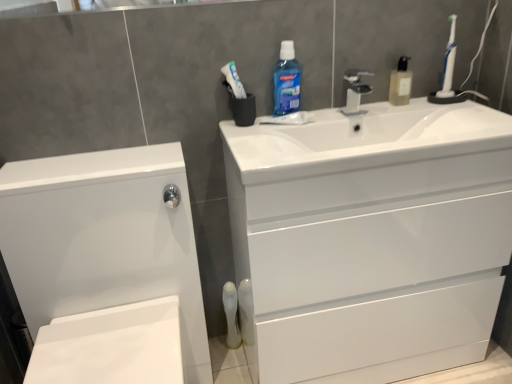
What do you see at coordinates (449, 63) in the screenshot? The width and height of the screenshot is (512, 384). I see `white plastic toothbrush at upper right` at bounding box center [449, 63].

Where is `blue translucent liquid at upper center, the first cleaning product viewed from the left`? This screenshot has height=384, width=512. blue translucent liquid at upper center, the first cleaning product viewed from the left is located at coordinates (286, 81).

This screenshot has height=384, width=512. Describe the element at coordinates (354, 91) in the screenshot. I see `satin nickel faucet at center` at that location.

Locate an element on the screen. translucent plastic soap dispenser at upper right, the 1th cleaning product from the right is located at coordinates tap(400, 83).

Is translucent plastic soap dispenser at upper right, the 1th cleaning product from the right, positioned with its back to satin nickel faucet at center?

That's not correct — translucent plastic soap dispenser at upper right, the 1th cleaning product from the right, is not looking away from satin nickel faucet at center.

Consider the image. Can you confirm if translucent plastic soap dispenser at upper right, the 1th cleaning product from the right, is smaller than satin nickel faucet at center?

Actually, translucent plastic soap dispenser at upper right, the 1th cleaning product from the right, might be larger than satin nickel faucet at center.

Which is less distant, (404, 76) or (354, 104)?

Positioned in front is point (404, 76).

In the image, is translucent plastic soap dispenser at upper right, the second cleaning product from the left, positioned in front of or behind satin nickel faucet at center?

In the image, translucent plastic soap dispenser at upper right, the second cleaning product from the left, appears behind satin nickel faucet at center.

Which of these two, translucent plastic soap dispenser at upper right, the second cleaning product from the left, or white plastic toothbrush at upper right, is wider?

translucent plastic soap dispenser at upper right, the second cleaning product from the left, is wider.

From a real-world perspective, which object stands above the other?

white plastic toothbrush at upper right, from a real-world perspective.

Are translucent plastic soap dispenser at upper right, the 1th cleaning product from the right, and white plastic toothbrush at upper right located far from each other?

No, there isn't a large distance between translucent plastic soap dispenser at upper right, the 1th cleaning product from the right, and white plastic toothbrush at upper right.

From the picture: Is translucent plastic soap dispenser at upper right, the second cleaning product from the left, turned away from white plastic toothbrush at upper right?

No, white plastic toothbrush at upper right is not at the back of translucent plastic soap dispenser at upper right, the second cleaning product from the left.

Which is in front, point (152, 309) or point (461, 156)?

Positioned in front is point (461, 156).

Would you say white glossy cabinet at lower left contains white glossy drawer at center?

No, white glossy drawer at center is located outside of white glossy cabinet at lower left.

Between white glossy cabinet at lower left and white glossy drawer at center, which one has smaller width?

white glossy drawer at center is thinner.

Is white glossy cabinet at lower left further to camera compared to white glossy drawer at center?

No, it is not.

From a real-world perspective, is white glossy cabinet at lower left below blue translucent liquid at upper center, acting as the second cleaning product starting from the right?

Yes, from a real-world perspective, white glossy cabinet at lower left is under blue translucent liquid at upper center, acting as the second cleaning product starting from the right.

Does white glossy cabinet at lower left appear on the right side of blue translucent liquid at upper center, the first cleaning product viewed from the left?

Incorrect, white glossy cabinet at lower left is not on the right side of blue translucent liquid at upper center, the first cleaning product viewed from the left.

Would you say white glossy cabinet at lower left is inside or outside blue translucent liquid at upper center, the first cleaning product viewed from the left?

white glossy cabinet at lower left exists outside the volume of blue translucent liquid at upper center, the first cleaning product viewed from the left.

Does white plastic toothbrush at upper right turn towards white glossy cabinet at lower left?

No, white plastic toothbrush at upper right is not facing towards white glossy cabinet at lower left.

Is the surface of white plastic toothbrush at upper right in direct contact with white glossy cabinet at lower left?

No, white plastic toothbrush at upper right is not beside white glossy cabinet at lower left.

From the image's perspective, between white plastic toothbrush at upper right and white glossy cabinet at lower left, who is located below?

white glossy cabinet at lower left, from the image's perspective.

Is white plastic toothbrush at upper right further to camera compared to translucent plastic mouthwash at lower center?

No, white plastic toothbrush at upper right is closer to the viewer.

From the image's perspective, would you say white plastic toothbrush at upper right is shown under translucent plastic mouthwash at lower center?

Incorrect, from the image's perspective, white plastic toothbrush at upper right is higher than translucent plastic mouthwash at lower center.

Considering the positions of point (451, 21) and point (234, 326), is point (451, 21) closer or farther from the camera than point (234, 326)?

Point (451, 21) is positioned closer to the camera compared to point (234, 326).

Locate an element on the screen. counter top in front of the blue translucent liquid at upper center, the first cleaning product viewed from the left is located at coordinates (371, 238).

Is blue translucent liquid at upper center, the first cleaning product viewed from the left, located within white glossy sink at upper center?

That's incorrect, blue translucent liquid at upper center, the first cleaning product viewed from the left, is not inside white glossy sink at upper center.

Is white glossy sink at upper center wider than blue translucent liquid at upper center, acting as the second cleaning product starting from the right?

Correct, the width of white glossy sink at upper center exceeds that of blue translucent liquid at upper center, acting as the second cleaning product starting from the right.

The width and height of the screenshot is (512, 384). Find the location of `tap lying in front of the translucent plastic soap dispenser at upper right, the 1th cleaning product from the right`. tap lying in front of the translucent plastic soap dispenser at upper right, the 1th cleaning product from the right is located at coordinates (354, 91).

You are a GUI agent. You are given a task and a screenshot of the screen. Output one action in this format:
    pyautogui.click(x=<x>, y=<y>)
    Task: Click on the toothbrush on the right of translucent plastic soap dispenser at upper right, the second cleaning product from the left
    
    Given the screenshot: What is the action you would take?
    pyautogui.click(x=449, y=63)

When comparing their distances from satin nickel faucet at center, does translucent plastic soap dispenser at upper right, the second cleaning product from the left, or translucent plastic mouthwash at lower center seem closer?

translucent plastic soap dispenser at upper right, the second cleaning product from the left, is closer to satin nickel faucet at center.

Estimate the real-world distances between objects in this image. Which object is further from white glossy sink at upper center, white glossy drawer at center or translucent plastic soap dispenser at upper right, the 1th cleaning product from the right?

translucent plastic soap dispenser at upper right, the 1th cleaning product from the right, is further to white glossy sink at upper center.

Estimate the real-world distances between objects in this image. Which object is further from white glossy sink at upper center, white glossy drawer at center or white glossy cabinet at lower left?

white glossy cabinet at lower left is further to white glossy sink at upper center.

Considering their positions, is white glossy drawer at center positioned further to satin nickel faucet at center than blue translucent liquid at upper center, the first cleaning product viewed from the left?

white glossy drawer at center lies further to satin nickel faucet at center than the other object.

Estimate the real-world distances between objects in this image. Which object is further from translucent plastic soap dispenser at upper right, the second cleaning product from the left, white plastic toothbrush at upper right or translucent plastic mouthwash at lower center?

translucent plastic mouthwash at lower center is further to translucent plastic soap dispenser at upper right, the second cleaning product from the left.

When comparing their distances from white plastic toothbrush at upper right, does white glossy drawer at center or blue translucent liquid at upper center, acting as the second cleaning product starting from the right, seem further?

blue translucent liquid at upper center, acting as the second cleaning product starting from the right.

From the image, which object appears to be farther from blue translucent liquid at upper center, the first cleaning product viewed from the left, satin nickel faucet at center or translucent plastic mouthwash at lower center?

translucent plastic mouthwash at lower center.

Estimate the real-world distances between objects in this image. Which object is closer to satin nickel faucet at center, white glossy drawer at center or white plastic toothbrush at upper right?

The object closer to satin nickel faucet at center is white plastic toothbrush at upper right.

Locate an element on the screen. tap between white glossy cabinet at lower left and white glossy sink at upper center is located at coordinates (354, 91).

The height and width of the screenshot is (384, 512). In order to click on tap between translucent plastic soap dispenser at upper right, the 1th cleaning product from the right, and white glossy sink at upper center, in the vertical direction in this screenshot , I will do `click(354, 91)`.

Find the location of a particular element. The image size is (512, 384). tap between blue translucent liquid at upper center, acting as the second cleaning product starting from the right, and white glossy cabinet at lower left from top to bottom is located at coordinates (354, 91).

The width and height of the screenshot is (512, 384). I want to click on tap located between white glossy cabinet at lower left and translucent plastic soap dispenser at upper right, the second cleaning product from the left, in the left-right direction, so click(x=354, y=91).